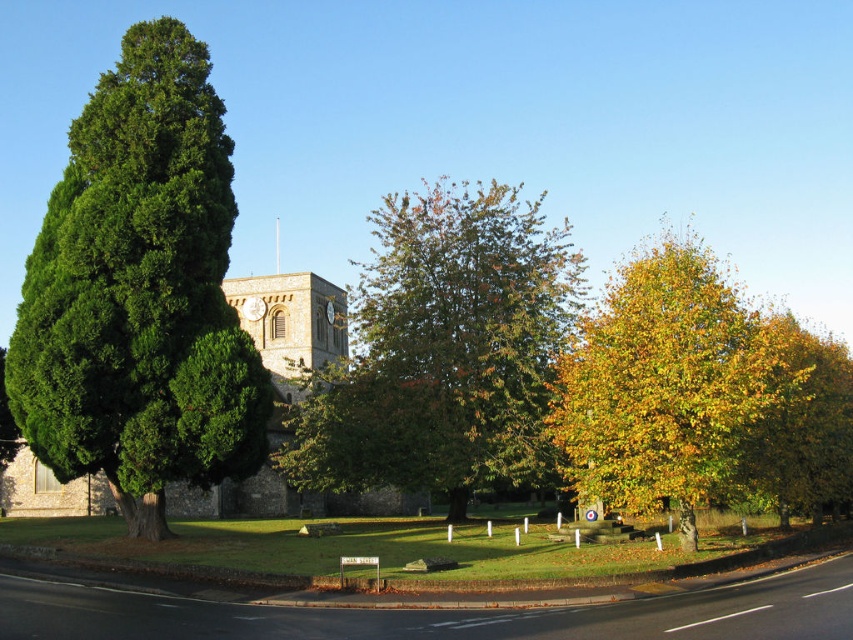
Who is more distant from viewer, (73, 435) or (728, 301)?

The point (728, 301) is behind.

Where is `green leafy tree at left`? The image size is (853, 640). green leafy tree at left is located at coordinates (140, 292).

Does green leafy tree at center have a lesser height compared to yellow-green foliage at right?

No.

Who is more forward, [520,404] or [660,470]?

Point [660,470] is in front.

You are a GUI agent. You are given a task and a screenshot of the screen. Output one action in this format:
    pyautogui.click(x=<x>, y=<y>)
    Task: Click on the green leafy tree at center
    The image size is (853, 640).
    Given the screenshot: What is the action you would take?
    pyautogui.click(x=444, y=349)

Does yellow-green foliage at right appear on the right side of yellow-green leaves at right?

No, yellow-green foliage at right is not to the right of yellow-green leaves at right.

Is point (704, 484) less distant than point (766, 416)?

Yes, it is.

Locate an element on the screen. yellow-green foliage at right is located at coordinates (671, 385).